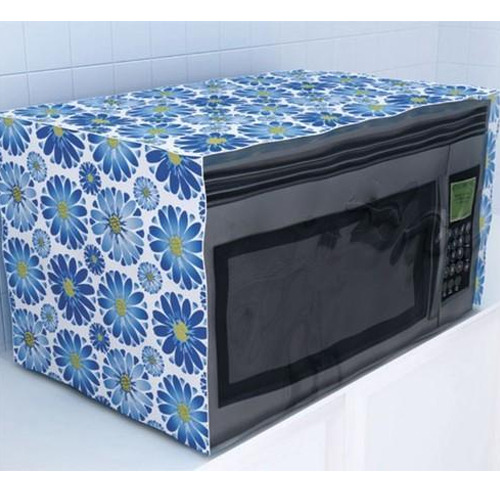
Identify the location of left side of microwave. The image size is (500, 500). (125, 370).